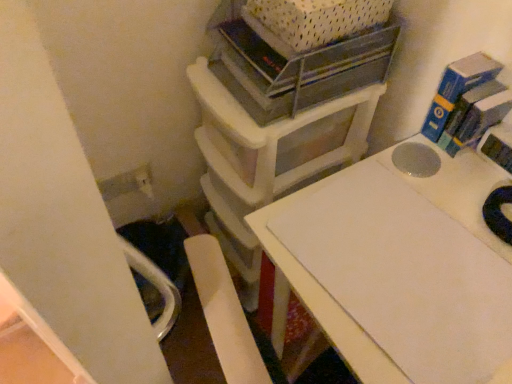
At what (x,y) coordinates should I click in order to perform the action: click on free space above white matte table at center (from a real-world perspective). Please return your answer as a coordinate pair (x, y). Looking at the image, I should click on (420, 245).